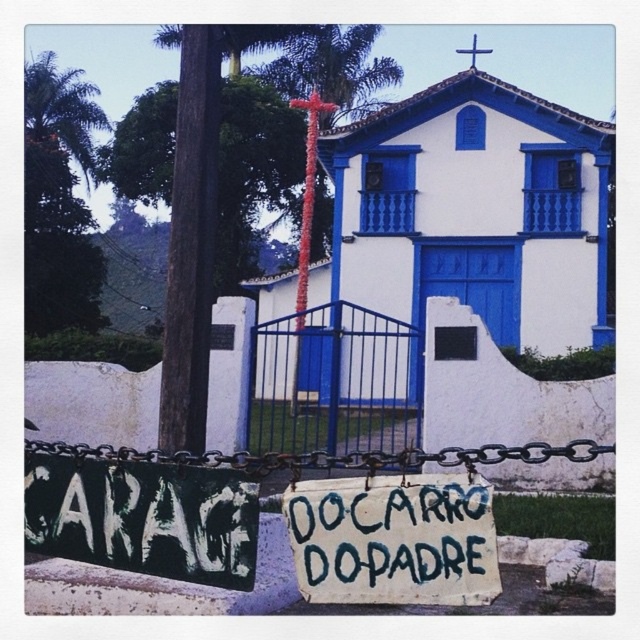
You are standing in front of the building and want to read the white painted wood sign at center. Which direction should you turn to face the brown wood pole at left?

The white painted wood sign at center is to the right of the brown wood pole at left. Therefore, you should turn to your left to face the brown wood pole at left.

You are a delivery driver who needs to park your truck between the two signs. The truck is 4 meters long. Can you fit your truck between the white painted wood sign at center and the other sign?

The distance between the white painted wood sign at center and the other sign is 3.93 meters. Since the truck is 4 meters long, it cannot fit between them as the space is slightly shorter than the truck.